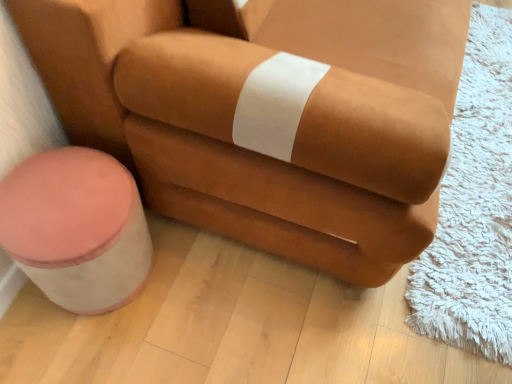
Question: Does pink fabric stool at lower left turn towards suede-like brown armchair at center?

Choices:
 (A) yes
 (B) no

Answer: (B)

Question: From a real-world perspective, is pink fabric stool at lower left located beneath suede-like brown armchair at center?

Choices:
 (A) no
 (B) yes

Answer: (B)

Question: Are pink fabric stool at lower left and suede-like brown armchair at center making contact?

Choices:
 (A) yes
 (B) no

Answer: (B)

Question: Is pink fabric stool at lower left positioned behind suede-like brown armchair at center?

Choices:
 (A) yes
 (B) no

Answer: (A)

Question: From the image's perspective, is pink fabric stool at lower left under suede-like brown armchair at center?

Choices:
 (A) yes
 (B) no

Answer: (A)

Question: Is pink fabric stool at lower left smaller than suede-like brown armchair at center?

Choices:
 (A) yes
 (B) no

Answer: (A)

Question: From a real-world perspective, is suede-like brown armchair at center physically above pink fabric stool at lower left?

Choices:
 (A) no
 (B) yes

Answer: (B)

Question: Is suede-like brown armchair at center wider than pink fabric stool at lower left?

Choices:
 (A) yes
 (B) no

Answer: (A)

Question: Is suede-like brown armchair at center to the left of pink fabric stool at lower left from the viewer's perspective?

Choices:
 (A) yes
 (B) no

Answer: (B)

Question: Is suede-like brown armchair at center turned away from pink fabric stool at lower left?

Choices:
 (A) yes
 (B) no

Answer: (B)

Question: Does suede-like brown armchair at center have a smaller size compared to pink fabric stool at lower left?

Choices:
 (A) yes
 (B) no

Answer: (B)

Question: Does suede-like brown armchair at center have a lesser height compared to pink fabric stool at lower left?

Choices:
 (A) no
 (B) yes

Answer: (A)

Question: Is suede-like brown armchair at center wider or thinner than pink fabric stool at lower left?

Choices:
 (A) wide
 (B) thin

Answer: (A)